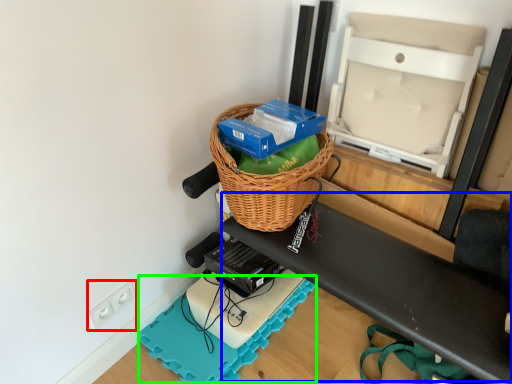
Question: Which is farther away from electric outlet (highlighted by a red box)? wide (highlighted by a blue box) or yoga mat (highlighted by a green box)?

Choices:
 (A) wide
 (B) yoga mat

Answer: (A)